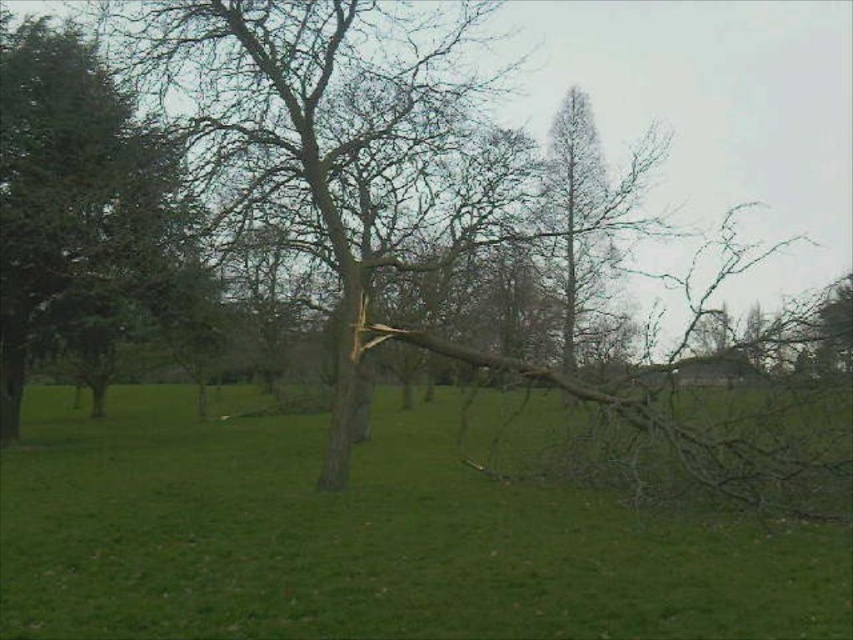
From the picture: Does brown wood log at center have a smaller size compared to green leafy tree at left?

Indeed, brown wood log at center has a smaller size compared to green leafy tree at left.

Can you confirm if brown wood log at center is wider than green leafy tree at left?

Correct, the width of brown wood log at center exceeds that of green leafy tree at left.

At what (x,y) coordinates should I click in order to perform the action: click on brown wood log at center. Please return your answer as a coordinate pair (x, y). This screenshot has height=640, width=853. Looking at the image, I should click on pyautogui.click(x=364, y=538).